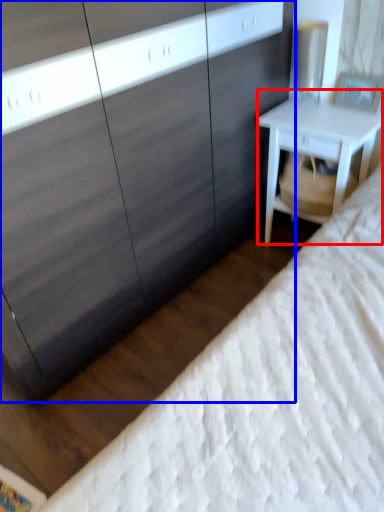
Question: Which of the following is the farthest to the observer, nightstand (highlighted by a red box) or dresser (highlighted by a blue box)?

Choices:
 (A) nightstand
 (B) dresser

Answer: (A)